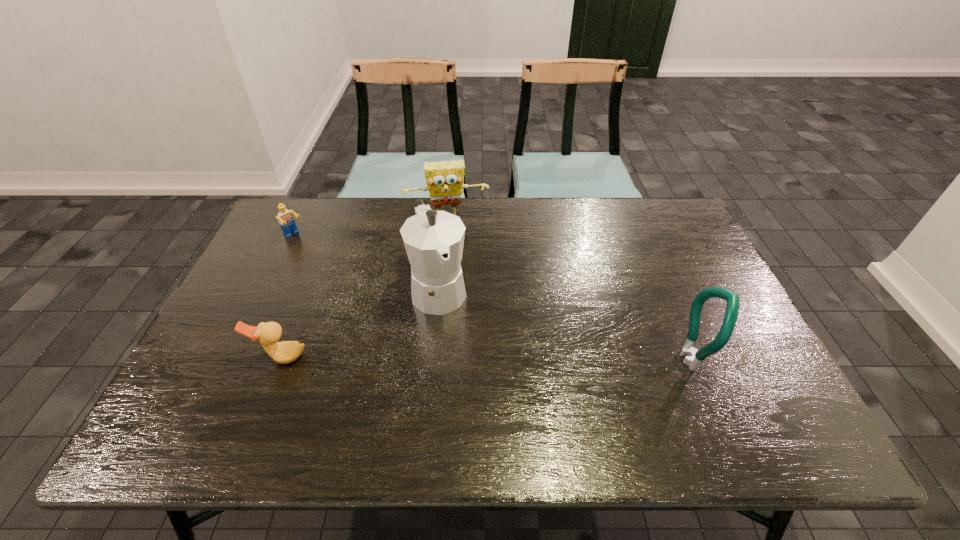
Find the location of `the second object from left to right`. the second object from left to right is located at coordinates pyautogui.click(x=268, y=334).

Identify the location of bottle opener. (693, 358).

Where is `the farthest object`? The width and height of the screenshot is (960, 540). the farthest object is located at coordinates (444, 179).

Identify the location of the leftmost object. (286, 221).

What are the coordinates of `Lego` in the screenshot? It's located at (286, 221).

At what (x,y) coordinates should I click in order to perform the action: click on the third nearest object. Please return your answer as a coordinate pair (x, y). This screenshot has width=960, height=540. Looking at the image, I should click on (434, 240).

This screenshot has height=540, width=960. What are the coordinates of `the tallest object` in the screenshot? It's located at (434, 240).

You are a GUI agent. You are given a task and a screenshot of the screen. Output one action in this format:
    pyautogui.click(x=<x>, y=<y>)
    Task: Click on the free space located 0.090m on the beak of the duck
    This screenshot has height=540, width=960.
    Given the screenshot: What is the action you would take?
    pyautogui.click(x=264, y=402)

At what (x,y) coordinates should I click in order to perform the action: click on vacant space situated at the jaws of the bottle opener. Please return your answer as a coordinate pair (x, y). Image resolution: width=960 pixels, height=540 pixels. Looking at the image, I should click on (733, 359).

Image resolution: width=960 pixels, height=540 pixels. What are the coordinates of `blank area located 0.110m on the face of the sponge` in the screenshot? It's located at (455, 250).